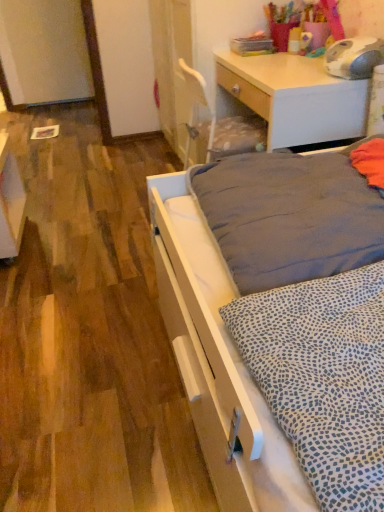
This screenshot has width=384, height=512. I want to click on free location to the right of white glossy vanity at lower left, so click(x=70, y=237).